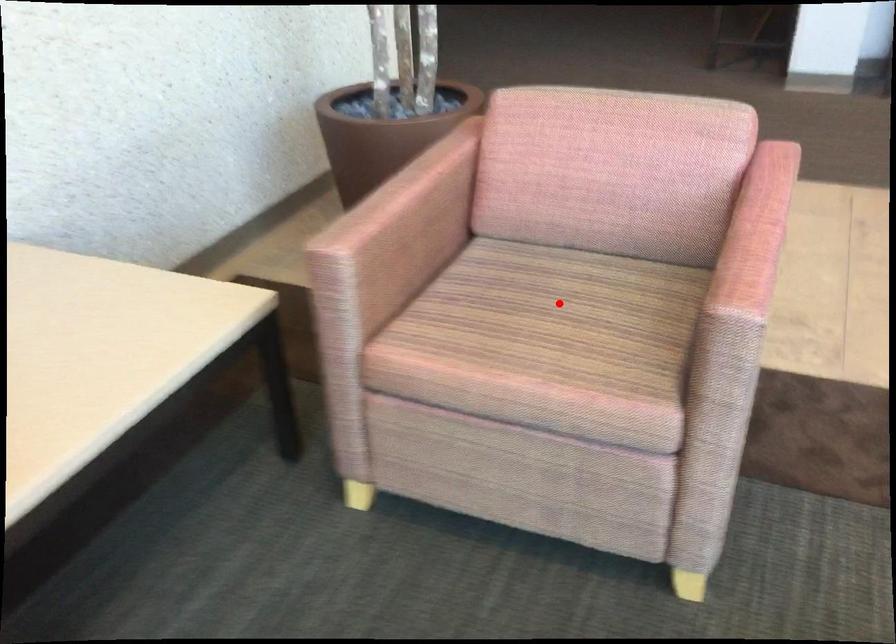
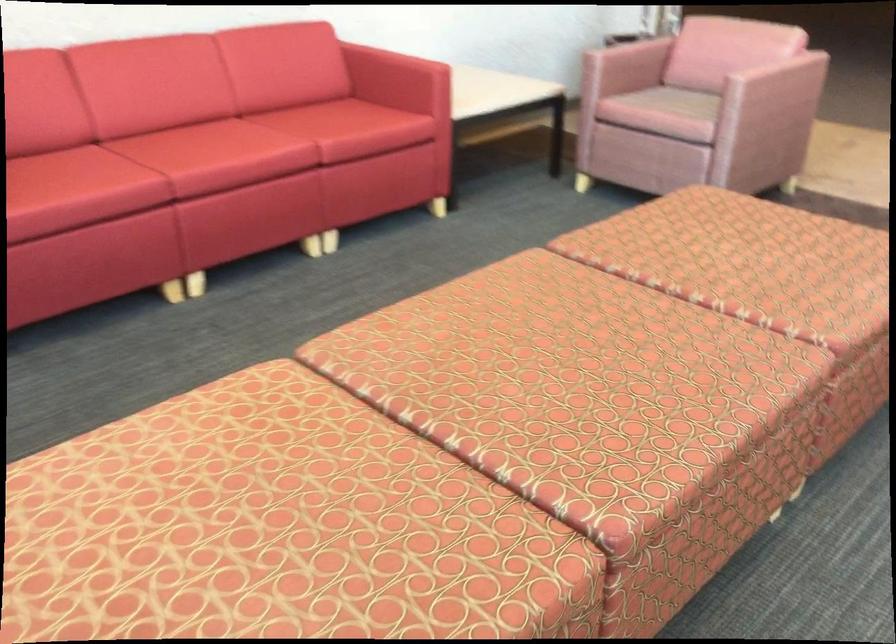
Find the pixel in the second image that matches the highlighted location in the first image.

(686, 102)